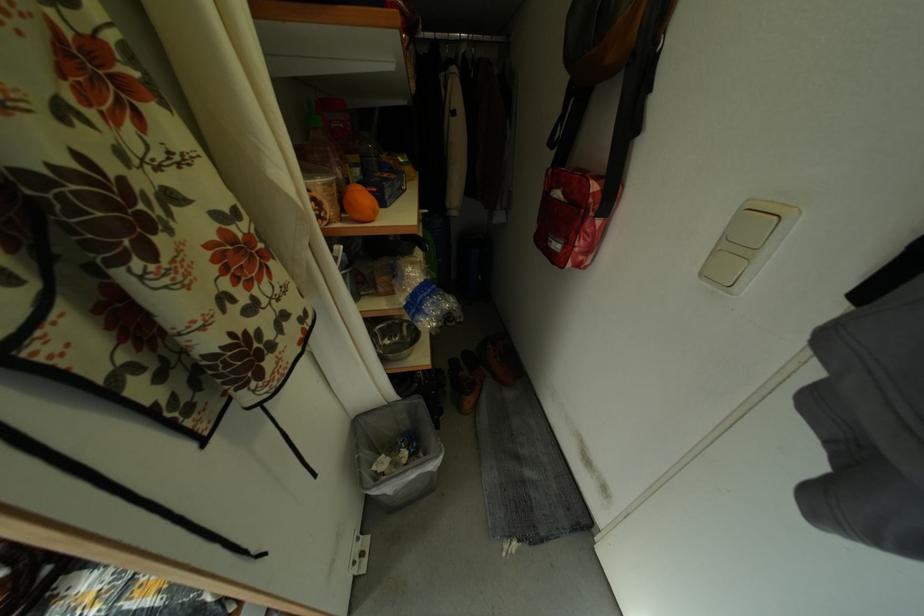
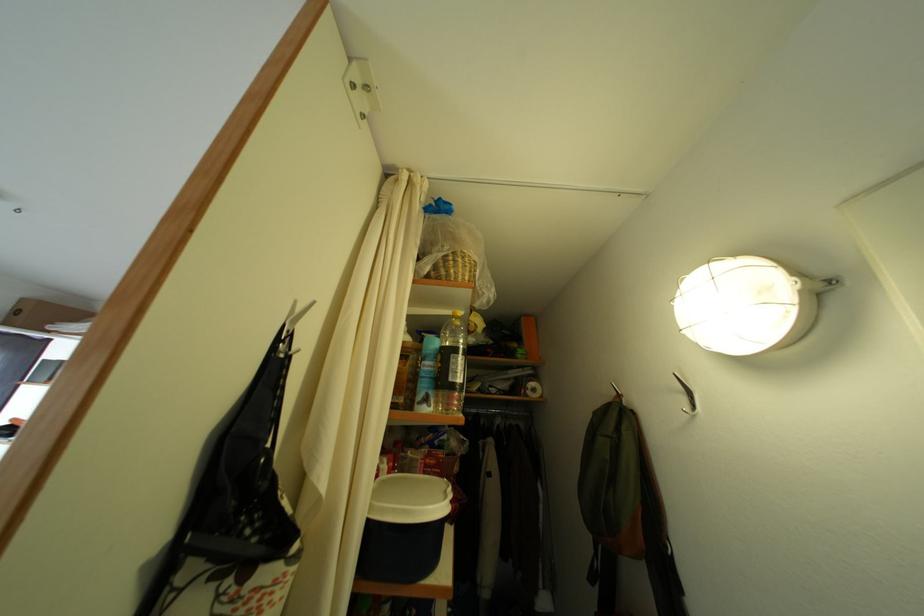
Question: The images are taken continuously from a first-person perspective. In which direction is your viewpoint rotating?

Choices:
 (A) Left
 (B) Right
 (C) Up
 (D) Down

Answer: (C)